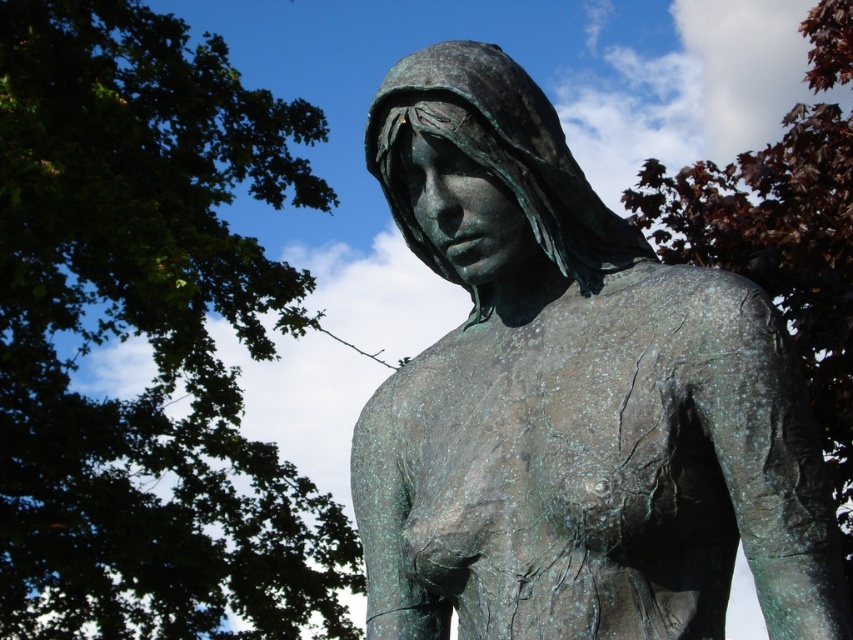
You are standing in front of the bronze statue of a figure under a bright blue sky. There is a point marked at coordinates point (x=148, y=337). Based on the scene, can you tell me what object this point is located on?

The point (x=148, y=337) is located on the green leafy tree at upper left.

You are an art student analyzing the composition of the image. The green patina statue at center and the dark red leaves at upper right are both focal points. Which object is located to the left of the other?

The green patina statue at center is positioned on the left side of dark red leaves at upper right.

You are an artist planning to paint the statue in the center of the image. You notice the green leafy tree at upper left and the dark red leaves at upper right. Which object should you paint first if you want to follow the rule of painting larger objects before smaller ones?

The green leafy tree at upper left should be painted first because it is larger than the dark red leaves at upper right according to the description.